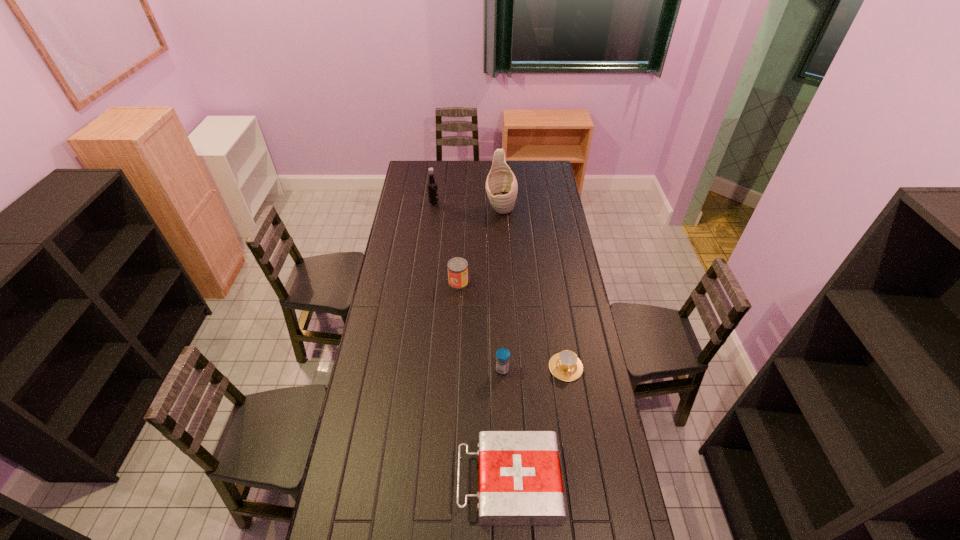
The image size is (960, 540). Find the location of `empty space between the fourth nearest object and the rightmost object`. empty space between the fourth nearest object and the rightmost object is located at coordinates (512, 325).

What are the coordinates of `vacant space that is in between the third farthest object and the tallest object` in the screenshot? It's located at (480, 246).

Locate which object is the second closest to the medicine. Please provide its 2D coordinates. Your answer should be formatted as a tuple, i.e. [(x, y)], where the tuple contains the x and y coordinates of a point satisfying the conditions above.

[(520, 482)]

You are a GUI agent. You are given a task and a screenshot of the screen. Output one action in this format:
    pyautogui.click(x=<x>, y=<y>)
    Task: Click on the closest object to the nearest object
    This screenshot has width=960, height=540.
    Given the screenshot: What is the action you would take?
    pyautogui.click(x=566, y=366)

You are a GUI agent. You are given a task and a screenshot of the screen. Output one action in this format:
    pyautogui.click(x=<x>, y=<y>)
    Task: Click on the vacant space that satisfies the following two spatial constraints: 1. on the front side of the medicine; 2. on the right side of the can
    
    Given the screenshot: What is the action you would take?
    (454, 370)

Locate an element on the screen. Image resolution: width=960 pixels, height=540 pixels. free space that satisfies the following two spatial constraints: 1. on the label of the second tallest object; 2. on the right side of the medicine is located at coordinates (413, 370).

Where is `vacant space that satisfies the following two spatial constraints: 1. on the label of the root beer; 2. on the back side of the fourth nearest object`? The image size is (960, 540). vacant space that satisfies the following two spatial constraints: 1. on the label of the root beer; 2. on the back side of the fourth nearest object is located at coordinates (424, 282).